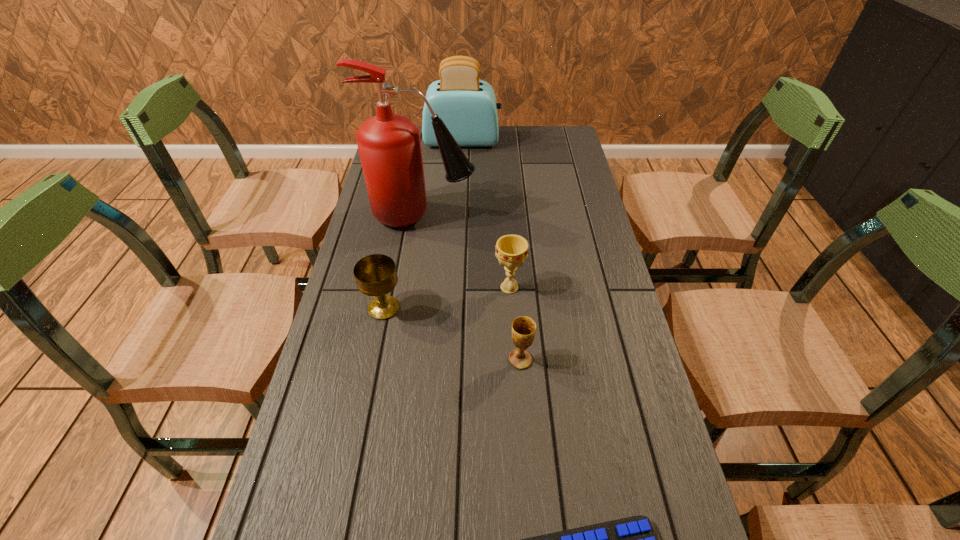
The height and width of the screenshot is (540, 960). What are the coordinates of `free space between the leftmost chalice and the nearest chalice` in the screenshot? It's located at click(452, 334).

Where is `empty space that is in between the tallest object and the second tallest object`? This screenshot has height=540, width=960. empty space that is in between the tallest object and the second tallest object is located at coordinates (443, 178).

The width and height of the screenshot is (960, 540). What are the coordinates of `free spot between the toaster and the second farthest object` in the screenshot? It's located at (443, 178).

Identify which object is the fourth closest to the leftmost chalice. Please provide its 2D coordinates. Your answer should be formatted as a tuple, i.e. [(x, y)], where the tuple contains the x and y coordinates of a point satisfying the conditions above.

[(632, 539)]

Locate an element on the screen. The height and width of the screenshot is (540, 960). object that can be found as the third closest to the second nearest object is located at coordinates (632, 539).

Identify which chalice is located as the nearest to the fire extinguisher. Please provide its 2D coordinates. Your answer should be formatted as a tuple, i.e. [(x, y)], where the tuple contains the x and y coordinates of a point satisfying the conditions above.

[(511, 250)]

Identify which chalice is the closest to the nearest chalice. Please provide its 2D coordinates. Your answer should be formatted as a tuple, i.e. [(x, y)], where the tuple contains the x and y coordinates of a point satisfying the conditions above.

[(511, 250)]

The height and width of the screenshot is (540, 960). What are the coordinates of `vacant space that satisfies the following two spatial constraints: 1. on the front side of the second nearest object; 2. on the left side of the leftmost chalice` in the screenshot? It's located at (373, 360).

I want to click on free space that satisfies the following two spatial constraints: 1. on the side of the farthest object with the lever; 2. on the front side of the leftmost chalice, so click(x=454, y=308).

The image size is (960, 540). I want to click on free spot that satisfies the following two spatial constraints: 1. on the back side of the fifth farthest object; 2. with the nozzle aimed from the fire extinguisher, so click(x=510, y=215).